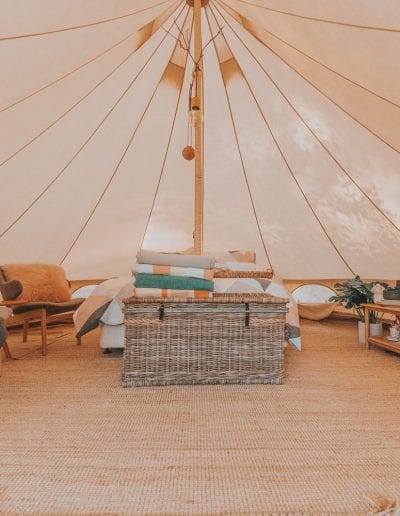
Locate an element on the screen. comforter is located at coordinates (277, 289).